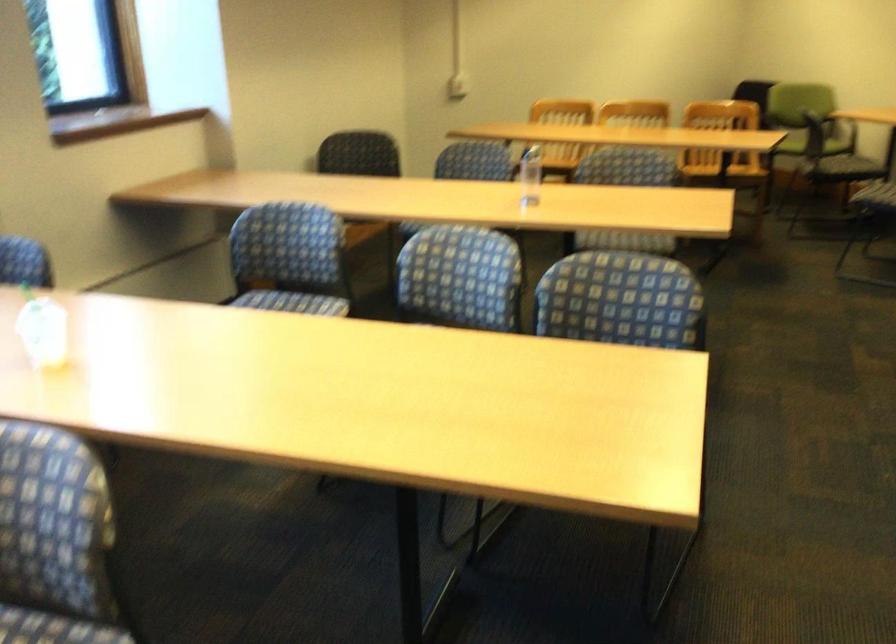
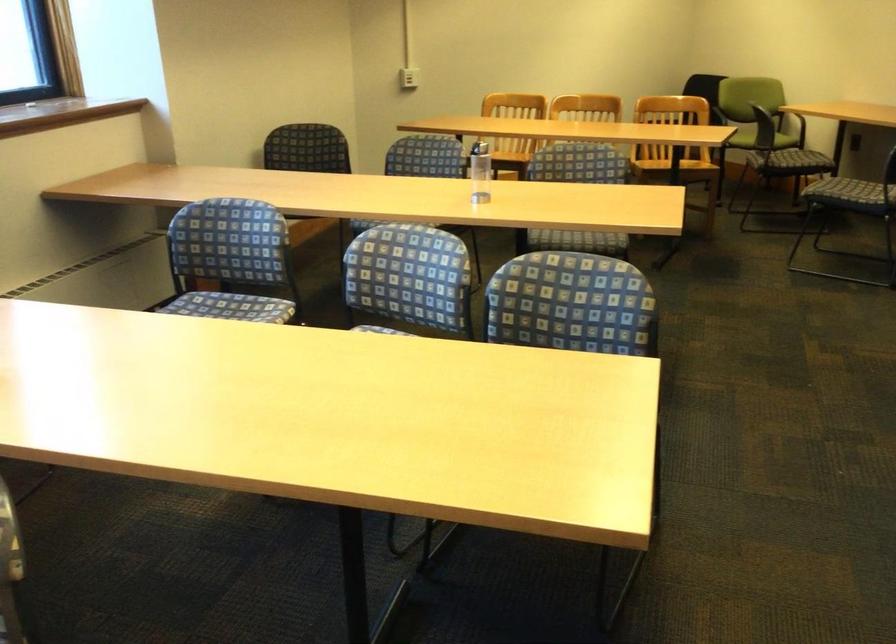
Question: Which direction would the cameraman need to move to produce the second image? Reply with the corresponding letter.

Choices:
 (A) Left
 (B) Right
 (C) Forward
 (D) Backward

Answer: (C)